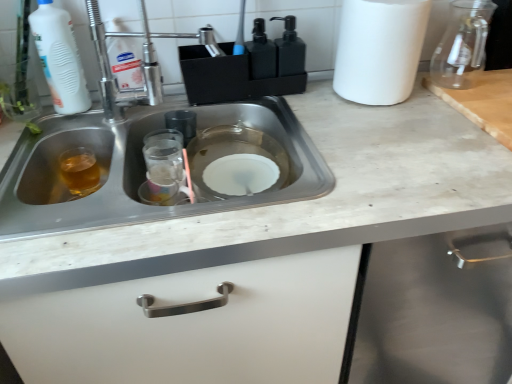
Locate an element on the screen. The height and width of the screenshot is (384, 512). vacant space in front of white matte paper towel at upper right is located at coordinates (399, 122).